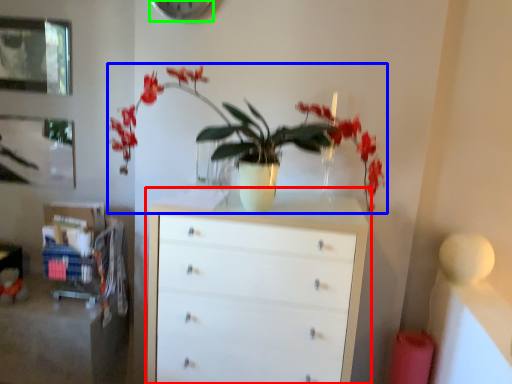
Question: Which is nearer to the chest of drawers (highlighted by a red box)? houseplant (highlighted by a blue box) or clock (highlighted by a green box).

Choices:
 (A) houseplant
 (B) clock

Answer: (A)